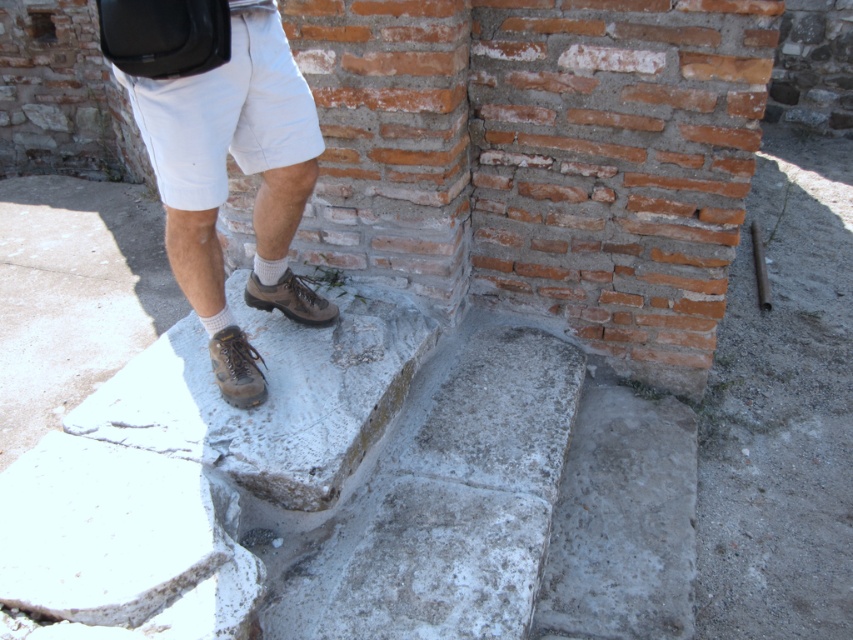
You are a photographer trying to capture the brown leather shoes at lower center and white cotton shorts at upper left in a single frame. Given that the camera can only focus on objects within a 10 cm height range, can both items be in focus simultaneously?

The brown leather shoes at lower center has a greater height compared to white cotton shorts at upper left. Since the camera can only focus on objects within a 0 cm to 10 cm height range, the difference in their heights might exceed this range. However, without knowing the exact height difference, it is impossible to determine if they can be in focus together.

You are a photographer trying to capture the person standing on the stone steps. You need to focus on the white cotton shorts at upper left and the brown suede shoe at center. Which object should you adjust your camera to focus on first if you want to start with the one closer to the foreground?

The brown suede shoe at center is closer to the foreground than the white cotton shorts at upper left, so you should focus on the brown suede shoe at center first.